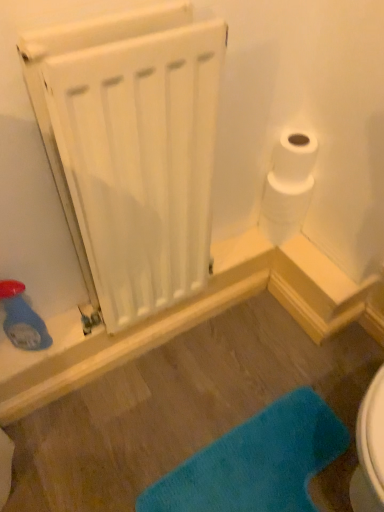
Locate an element on the screen. The height and width of the screenshot is (512, 384). vacant space underneath blue fuzzy bath mat at lower center (from a real-world perspective) is located at coordinates (263, 466).